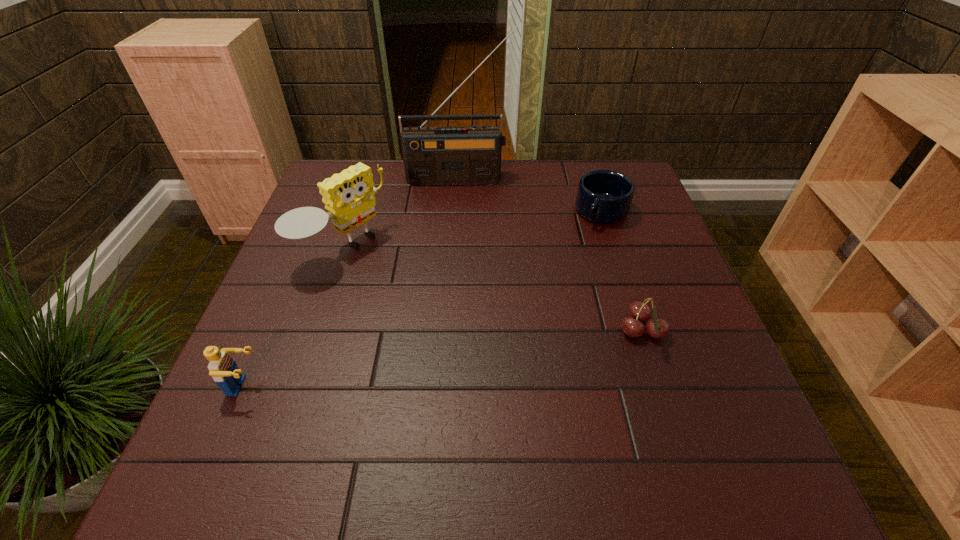
What are the coordinates of `Lego` in the screenshot? It's located at (223, 369).

In order to click on the nearest object in this screenshot , I will do `click(223, 369)`.

Where is `cherry`? cherry is located at coordinates (638, 311).

Identify the location of mug. Image resolution: width=960 pixels, height=540 pixels. (603, 196).

The width and height of the screenshot is (960, 540). What are the coordinates of `the second tallest object` in the screenshot? It's located at click(348, 196).

What are the coordinates of `the farthest object` in the screenshot? It's located at (469, 154).

Find the location of a particular element. Image resolution: width=960 pixels, height=540 pixels. the tallest object is located at coordinates (469, 154).

At what (x,y) coordinates should I click in order to perform the action: click on vacant space located on the face of the nearest object. Please return your answer as a coordinate pair (x, y). Image resolution: width=960 pixels, height=540 pixels. Looking at the image, I should click on coord(401,386).

At what (x,y) coordinates should I click in order to perform the action: click on vacant space located on the leaves of the cherry. Please return your answer as a coordinate pair (x, y). This screenshot has width=960, height=540. Looking at the image, I should click on (698, 331).

Locate an element on the screen. This screenshot has height=540, width=960. vacant space situated with the handle on the side of the mug is located at coordinates (528, 325).